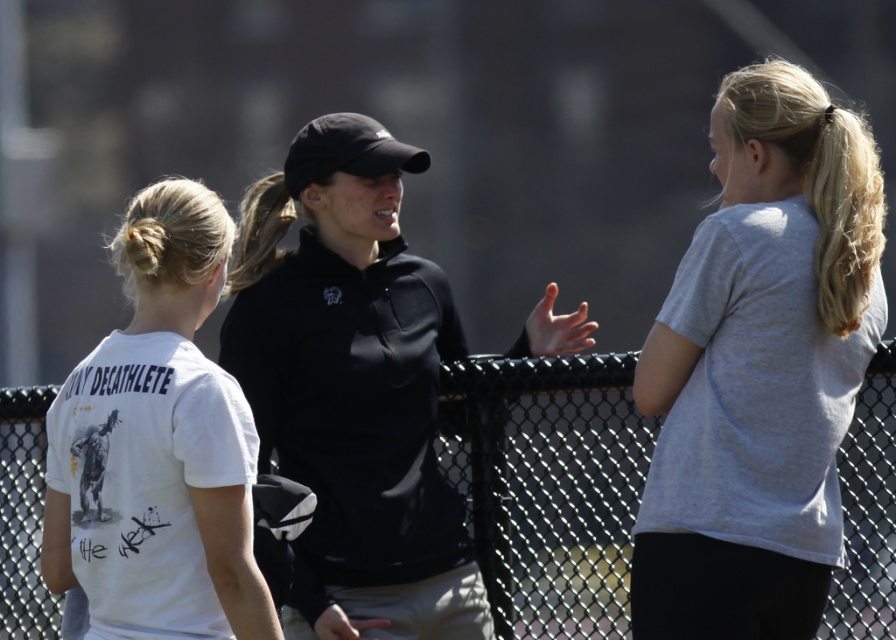
Which is more to the left, black matte jacket at center or black chain-link fence at center?

black matte jacket at center

Which is behind, point (289, 371) or point (539, 611)?

The point (539, 611) is more distant.

Is point (333, 300) closer to camera compared to point (616, 400)?

No, (333, 300) is further to viewer.

Find the location of a particular element. Image resolution: width=896 pixels, height=640 pixels. black matte jacket at center is located at coordinates (352, 387).

Between point (755, 64) and point (220, 202), which one is positioned in front?

Point (220, 202) is more forward.

Can you confirm if gray matte t-shirt at upper right is thinner than white matte t-shirt at center?

Yes, gray matte t-shirt at upper right is thinner than white matte t-shirt at center.

Is point (855, 392) closer to camera compared to point (200, 564)?

No, (855, 392) is behind (200, 564).

At what (x,y) coordinates should I click in order to perform the action: click on gray matte t-shirt at upper right. Please return your answer as a coordinate pair (x, y). Looking at the image, I should click on (759, 369).

Consider the image. Is gray matte t-shirt at upper right to the left of black chain-link fence at center from the viewer's perspective?

In fact, gray matte t-shirt at upper right is to the right of black chain-link fence at center.

Is gray matte t-shirt at upper right taller than black chain-link fence at center?

Yes, gray matte t-shirt at upper right is taller than black chain-link fence at center.

Is point (869, 285) closer to camera compared to point (29, 417)?

Yes, point (869, 285) is closer to viewer.

What are the coordinates of `gray matte t-shirt at upper right` in the screenshot? It's located at (759, 369).